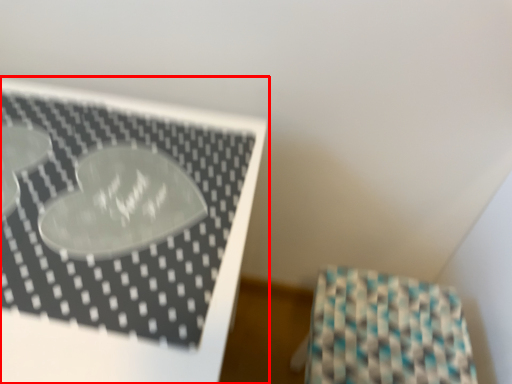
Question: From the image's perspective, where is furniture (annotated by the red box) located in relation to wrapping paper in the image?

Choices:
 (A) above
 (B) below

Answer: (A)